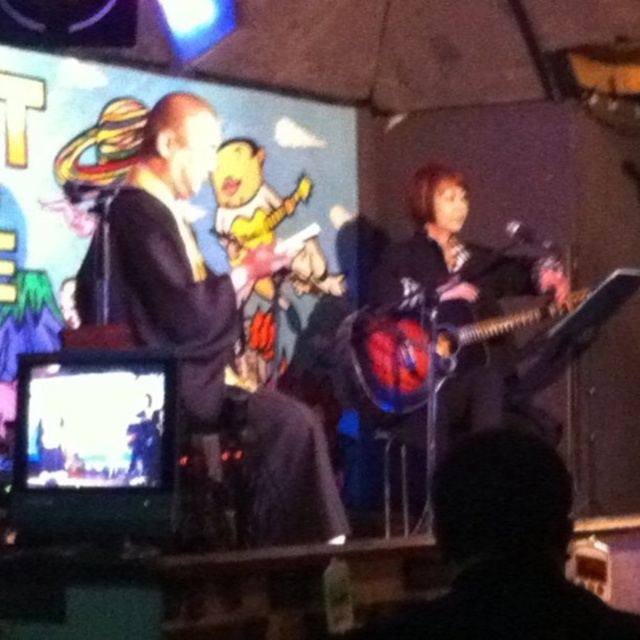
You are a photographer at the live performance and need to capture a photo that includes both the black leather jacket at upper left and the matte black guitar at center. Based on their positions, which object will appear larger in the photo?

The black leather jacket at upper left will appear larger in the photo because it is much taller than the matte black guitar at center.

You are a photographer at the back of the venue and want to capture a photo of both the black leather jacket at upper left and the shiny metallic guitar at center in the same frame. Based on their positions, which object should you adjust your camera to focus on first to ensure both are in the shot?

The black leather jacket at upper left is positioned on the left side of the shiny metallic guitar at center, so you should focus on the shiny metallic guitar at center first to ensure both are included in the frame.